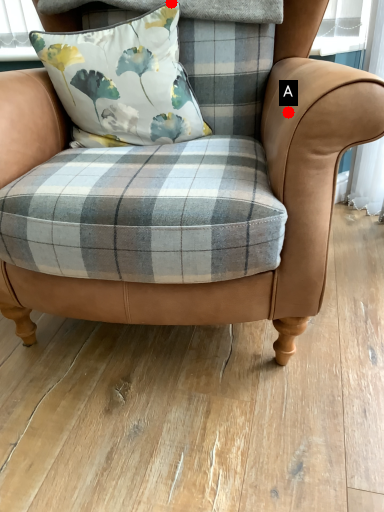
Question: Two points are circled on the image, labeled by A and B beside each circle. Among these points, which one is farthest from the camera?

Choices:
 (A) A is further
 (B) B is further

Answer: (B)